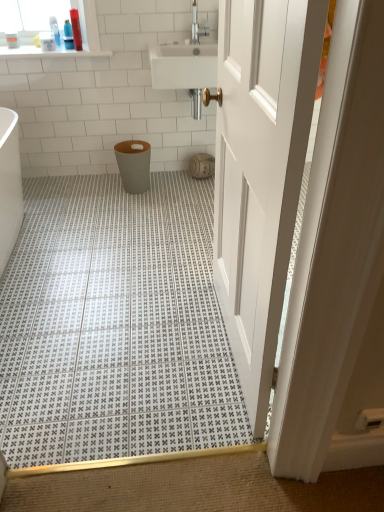
Where is `free location to the left of translucent plastic tube at upper left, arranged as the 1th toiletry when viewed from the right`? Image resolution: width=384 pixels, height=512 pixels. free location to the left of translucent plastic tube at upper left, arranged as the 1th toiletry when viewed from the right is located at coordinates point(60,50).